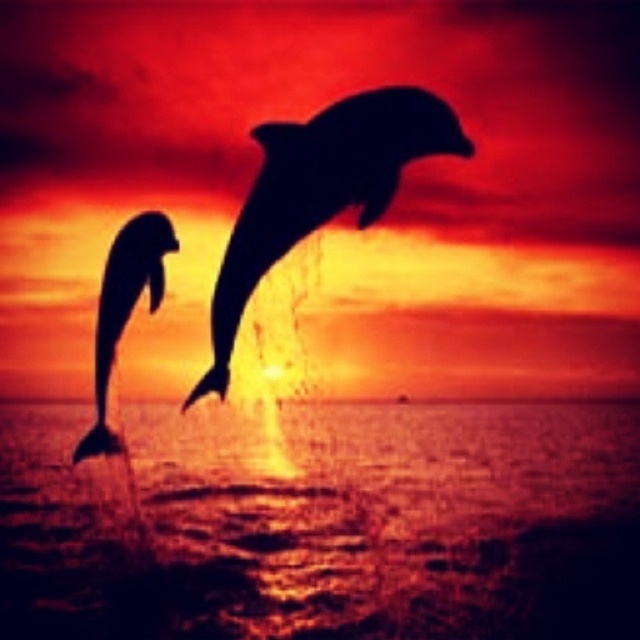
Question: Which of the following is the farthest from the observer?

Choices:
 (A) silhouette dolphin at left
 (B) black silhouette dolphin at center
 (C) transparent water at lower center

Answer: (C)

Question: Which is nearer to the black silhouette dolphin at center?

Choices:
 (A) silhouette dolphin at left
 (B) transparent water at lower center

Answer: (A)

Question: Can you confirm if transparent water at lower center is positioned above black silhouette dolphin at center?

Choices:
 (A) no
 (B) yes

Answer: (A)

Question: Considering the relative positions of transparent water at lower center and black silhouette dolphin at center in the image provided, where is transparent water at lower center located with respect to black silhouette dolphin at center?

Choices:
 (A) below
 (B) above

Answer: (A)

Question: Which of these objects is positioned closest to the black silhouette dolphin at center?

Choices:
 (A) transparent water at lower center
 (B) silhouette dolphin at left

Answer: (B)

Question: Can you confirm if black silhouette dolphin at center is thinner than silhouette dolphin at left?

Choices:
 (A) no
 (B) yes

Answer: (A)